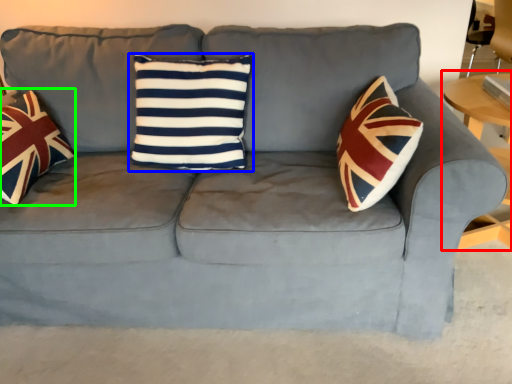
Question: Based on their relative distances, which object is nearer to table (highlighted by a red box)? Choose from pillow (highlighted by a blue box) and throw pillow (highlighted by a green box).

Choices:
 (A) pillow
 (B) throw pillow

Answer: (A)